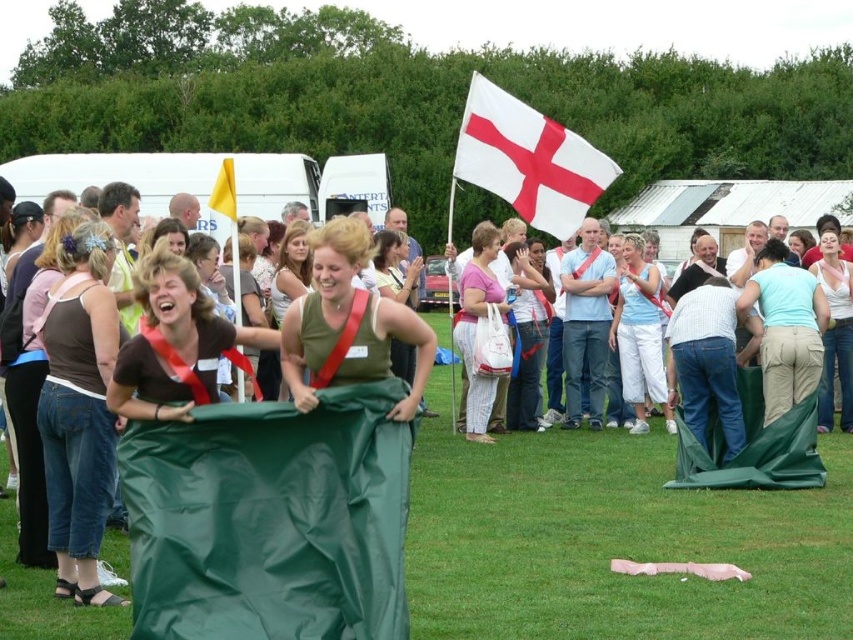
You are a participant in the sack race and want to know which flag is bigger between the white fabric flag at upper center and the yellow fabric flag at upper center. Can you tell me which one is larger?

The white fabric flag at upper center has a larger size compared to the yellow fabric flag at upper center, so the white fabric flag at upper center is bigger.